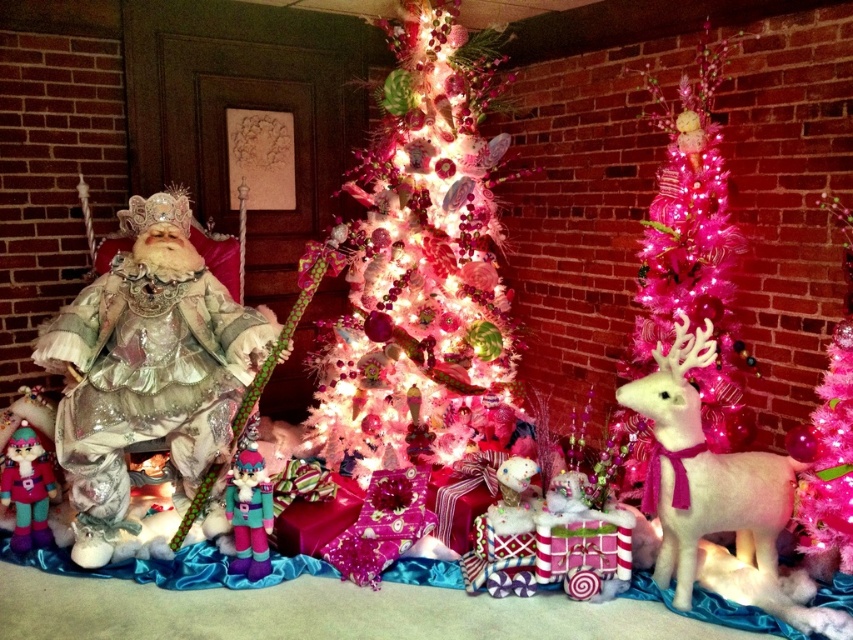
You are a delivery robot with a box that is 1.5 meters wide. You need to move from the white felt reindeer at right to the knitted teal and pink elf at center. Can you fit through the space between them?

The white felt reindeer at right is 1.44 meters from the knitted teal and pink elf at center, so the robot cannot fit through the space between them since the distance is less than the robot box width of 1.5 meters.

Based on the photo, you are standing in front of the festive Christmas display. The white glittery Christmas tree at center is at point (422, 266). If you want to place a new decoration exactly at the same position as the tree, where should you place it?

You should place the new decoration at the point (422, 266), which is the location of the white glittery Christmas tree at center.

You are a visitor standing in front of the Christmas display. You notice the white glittery christmas tree at center and the shiny silver doll at left. Which object is positioned higher in the scene?

The white glittery christmas tree at center is above the shiny silver doll at left, so it is positioned higher in the scene.